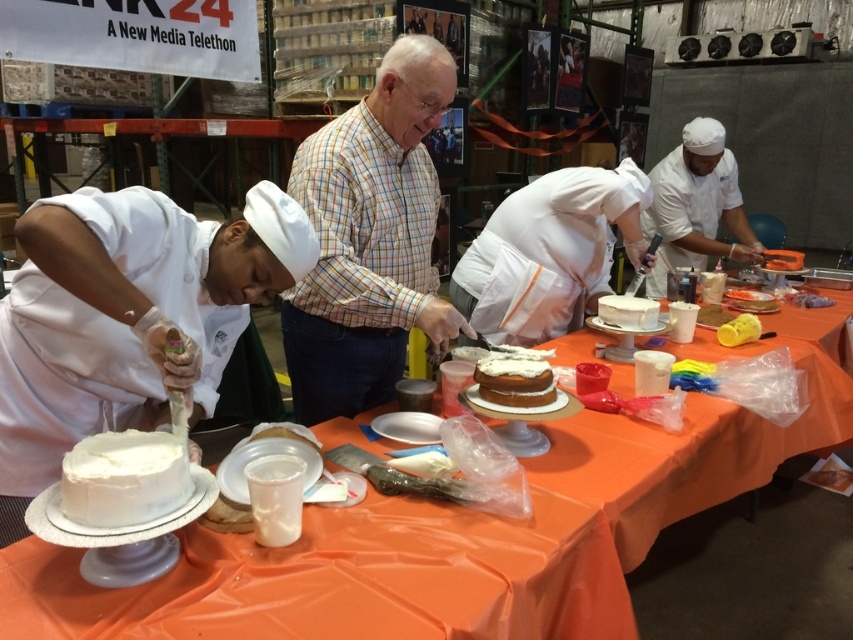
Who is more forward, (601, 285) or (677, 248)?

Positioned in front is point (601, 285).

The image size is (853, 640). I want to click on white matte chef hat at center, so click(549, 252).

Is point (225, 266) less distant than point (93, 518)?

That is False.

Can you confirm if white matte chef hat at left is bigger than white matte cake at center?

Indeed, white matte chef hat at left has a larger size compared to white matte cake at center.

Locate an element on the screen. This screenshot has height=640, width=853. white matte chef hat at left is located at coordinates (x=126, y=317).

The image size is (853, 640). What are the coordinates of `white matte chef hat at left` in the screenshot? It's located at (126, 317).

The width and height of the screenshot is (853, 640). Identify the location of white matte chef hat at left. (126, 317).

In the scene shown: Which is below, white matte chef hat at left or white matte chef hat at upper right?

white matte chef hat at left is below.

Where is `white matte chef hat at left`? white matte chef hat at left is located at coordinates (126, 317).